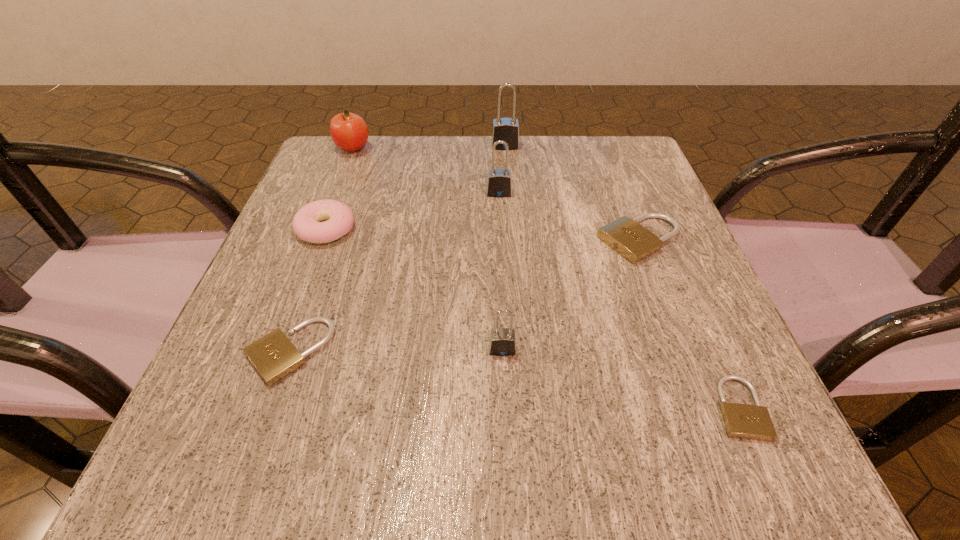
Identify the location of vacant space at the far edge of the desktop. (390, 182).

In the image, there is a desktop. What are the coordinates of `blank space at the near edge` in the screenshot? It's located at (601, 451).

In the image, there is a desktop. Find the location of `vacant region at the left edge`. vacant region at the left edge is located at coordinates (351, 243).

Locate an element on the screen. The width and height of the screenshot is (960, 540). vacant space at the right edge of the desktop is located at coordinates (651, 278).

In the image, there is a desktop. Where is `vacant region at the far left corner`? vacant region at the far left corner is located at coordinates (308, 190).

Where is `vacant space at the near left corner of the desktop`? vacant space at the near left corner of the desktop is located at coordinates (245, 425).

Where is `free space at the far right corner of the desktop`? The image size is (960, 540). free space at the far right corner of the desktop is located at coordinates (623, 162).

You are a GUI agent. You are given a task and a screenshot of the screen. Output one action in this format:
    pyautogui.click(x=<x>, y=<y>)
    Task: Click on the vacant space at the near right corner of the desktop
    
    Given the screenshot: What is the action you would take?
    pyautogui.click(x=685, y=489)

Locate an element on the screen. This screenshot has height=540, width=960. free space between the second farthest gray padlock and the doughnut is located at coordinates (413, 211).

You are a GUI agent. You are given a task and a screenshot of the screen. Output one action in this format:
    pyautogui.click(x=<x>, y=<y>)
    Task: Click on the vacant space that is in between the biggest gray padlock and the seventh tallest object
    The image size is (960, 540).
    Given the screenshot: What is the action you would take?
    pyautogui.click(x=397, y=249)